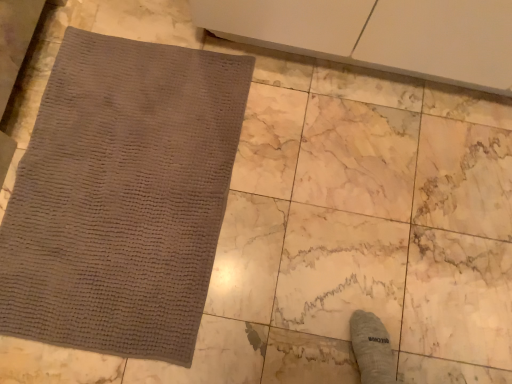
Where is `gray textured mat at lower left`? The width and height of the screenshot is (512, 384). gray textured mat at lower left is located at coordinates (122, 197).

What do you see at coordinates (122, 197) in the screenshot?
I see `gray textured mat at lower left` at bounding box center [122, 197].

At what (x,y) coordinates should I click in order to perform the action: click on gray textured mat at lower left. Please return your answer as a coordinate pair (x, y). This screenshot has height=384, width=512. Looking at the image, I should click on (122, 197).